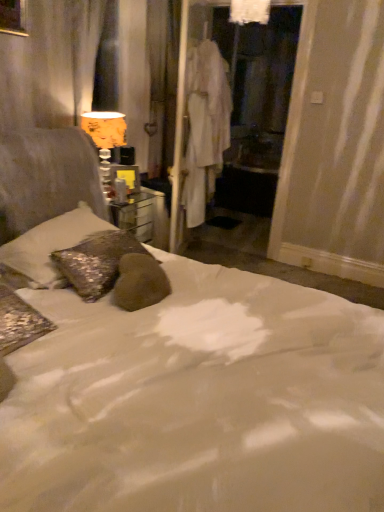
Question: From the image's perspective, is sparkly silver pillow at left under orange fabric lampshade at upper left?

Choices:
 (A) yes
 (B) no

Answer: (A)

Question: Is sparkly silver pillow at left oriented towards orange fabric lampshade at upper left?

Choices:
 (A) no
 (B) yes

Answer: (A)

Question: Is sparkly silver pillow at left smaller than orange fabric lampshade at upper left?

Choices:
 (A) yes
 (B) no

Answer: (B)

Question: Can you confirm if sparkly silver pillow at left is thinner than orange fabric lampshade at upper left?

Choices:
 (A) yes
 (B) no

Answer: (B)

Question: Can you confirm if sparkly silver pillow at left is positioned to the right of orange fabric lampshade at upper left?

Choices:
 (A) no
 (B) yes

Answer: (A)

Question: Would you say sparkly silver pillow at left is outside orange fabric lampshade at upper left?

Choices:
 (A) yes
 (B) no

Answer: (A)

Question: From a real-world perspective, is white fabric robe at center under white fabric screen door at center?

Choices:
 (A) no
 (B) yes

Answer: (B)

Question: Is white fabric robe at center bigger than white fabric screen door at center?

Choices:
 (A) no
 (B) yes

Answer: (A)

Question: From a real-world perspective, is white fabric robe at center on top of white fabric screen door at center?

Choices:
 (A) yes
 (B) no

Answer: (B)

Question: Can we say white fabric robe at center lies outside white fabric screen door at center?

Choices:
 (A) no
 (B) yes

Answer: (B)

Question: From the image's perspective, is white fabric robe at center located beneath white fabric screen door at center?

Choices:
 (A) no
 (B) yes

Answer: (B)

Question: Considering the relative sizes of white fabric robe at center and white fabric screen door at center in the image provided, is white fabric robe at center thinner than white fabric screen door at center?

Choices:
 (A) no
 (B) yes

Answer: (A)

Question: Is white fabric robe at center positioned behind orange fabric lampshade at upper left?

Choices:
 (A) yes
 (B) no

Answer: (A)